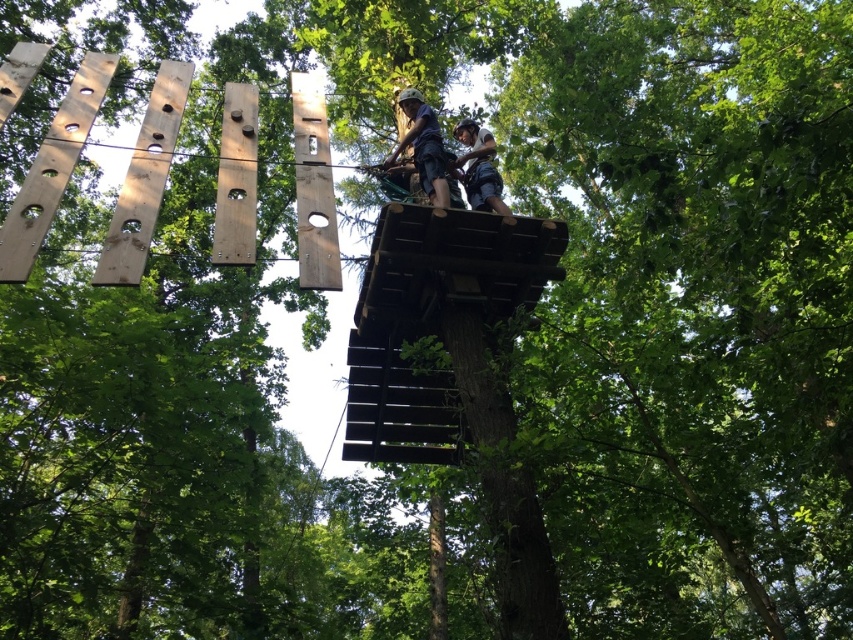
Between matte blue helmet at upper center and dark blue fabric harness at upper center, which one appears on the left side from the viewer's perspective?

matte blue helmet at upper center is more to the left.

Is matte blue helmet at upper center positioned at the back of dark blue fabric harness at upper center?

Yes, it is.

Which is behind, point (457, 200) or point (473, 125)?

The point (473, 125) is more distant.

The width and height of the screenshot is (853, 640). Find the location of `matte blue helmet at upper center`. matte blue helmet at upper center is located at coordinates (425, 150).